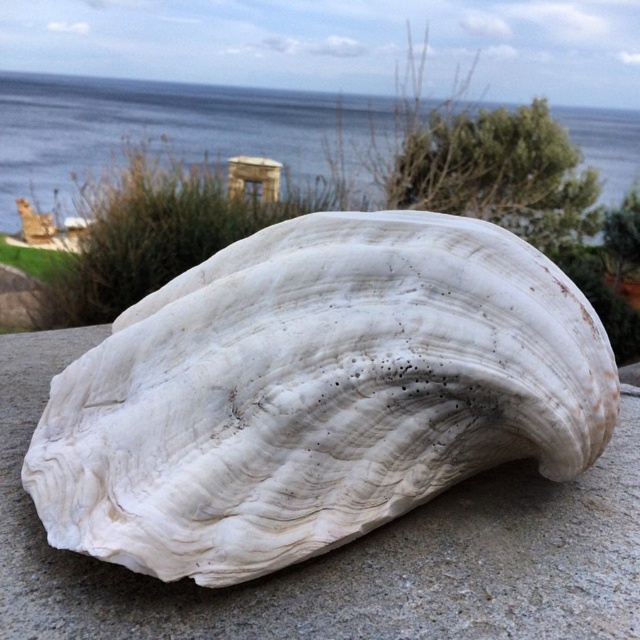
You are standing in front of a seashell and looking at the scene described. The white marble shell at center and the blue water at upper center are both in your view. Which object is positioned lower in the image?

The white marble shell at center is positioned lower than the blue water at upper center.

You are standing in front of the scene and want to pick up the white marble shell at center. Will you have to move the blue water at upper center to reach it?

The white marble shell at center is closer to the viewer than the blue water at upper center, so you do not need to move the blue water at upper center to reach it.